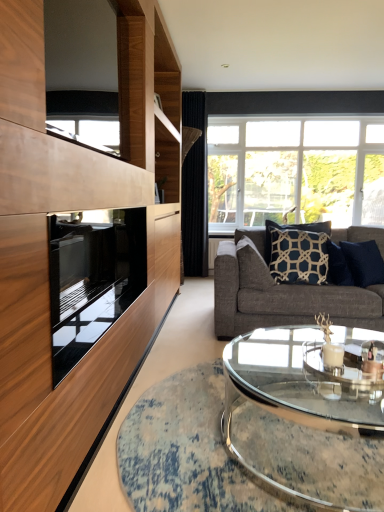
Question: From the image's perspective, is dark blue textured pillow at center, which is the 3th pillow in right-to-left order, located above or below black velvet curtain at center?

Choices:
 (A) above
 (B) below

Answer: (B)

Question: Is dark blue textured pillow at center, which is the 3th pillow in right-to-left order, taller or shorter than black velvet curtain at center?

Choices:
 (A) tall
 (B) short

Answer: (B)

Question: Estimate the real-world distances between objects in this image. Which object is closer to the black glass oven at left?

Choices:
 (A) black velvet curtain at center
 (B) dark blue textured pillow at center right, arranged as the 3th pillow when viewed from the left
 (C) dark blue textured pillow at center, which is the 3th pillow in right-to-left order
 (D) navy blue fabric pillow at center, marked as the 2th pillow in a left-to-right arrangement
 (E) clear glass coffee table at center

Answer: (E)

Question: Based on their relative distances, which object is nearer to the dark blue textured pillow at center, which is the 3th pillow in right-to-left order?

Choices:
 (A) black velvet curtain at center
 (B) navy blue fabric pillow at center, marked as the 2th pillow in a left-to-right arrangement
 (C) black glass oven at left
 (D) clear glass coffee table at center
 (E) dark blue textured pillow at center right, arranged as the 3th pillow when viewed from the left

Answer: (B)